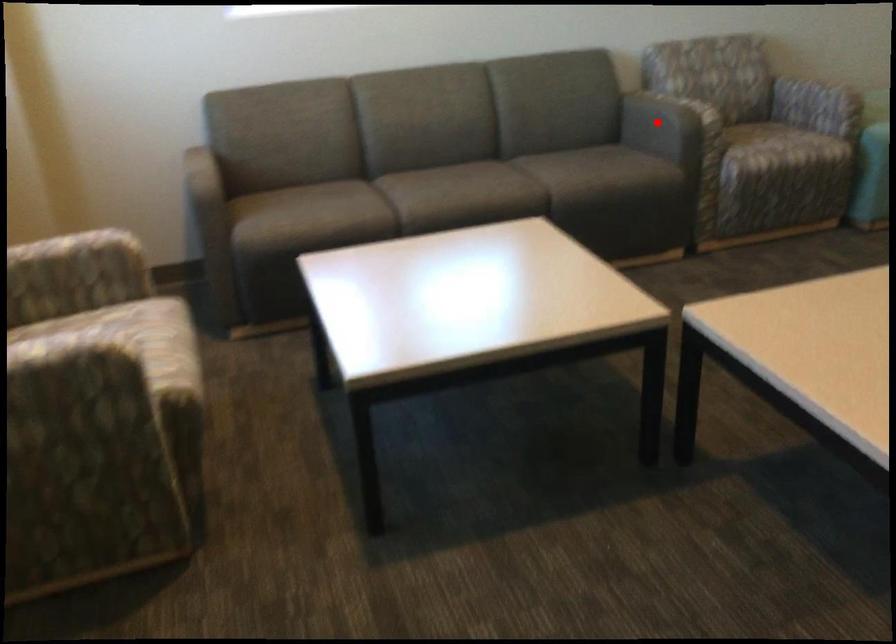
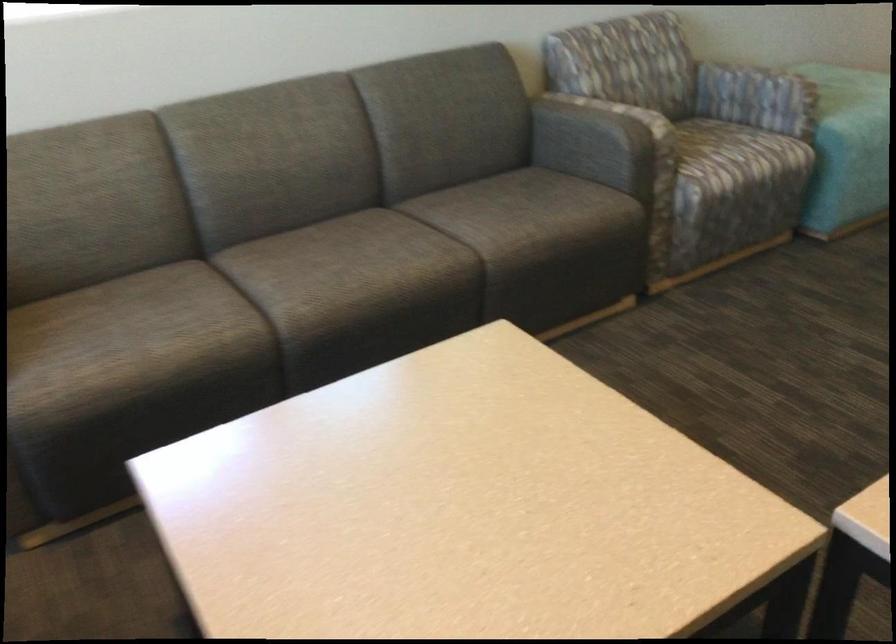
Question: I am providing you with two images of the same scene from different viewpoints. Image1 has a red point marked. In image2, the corresponding 3D location appears at what relative position? Reply with the corresponding letter.

Choices:
 (A) Closer
 (B) Farther

Answer: (A)